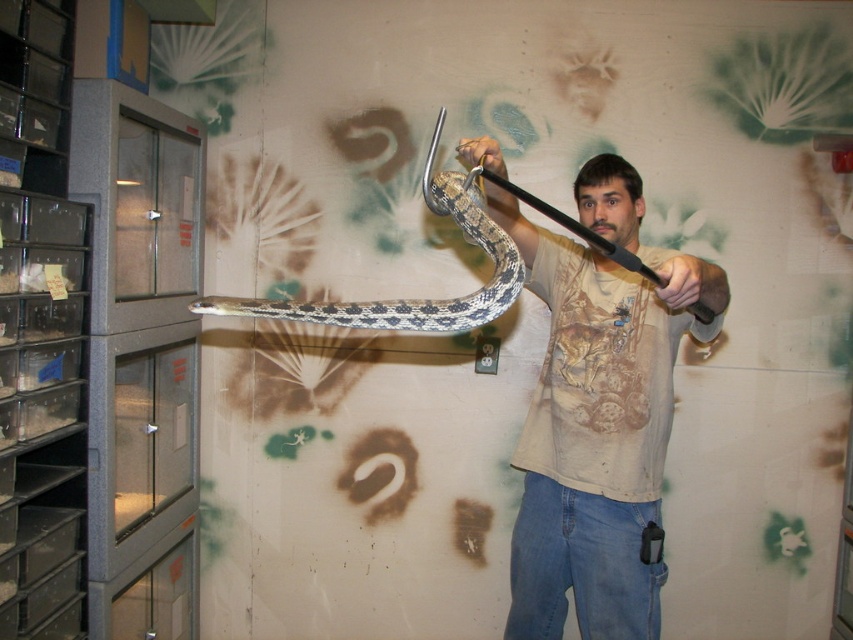
Who is lower down, light brown cotton t-shirt at center or patterned scales snake at center?

light brown cotton t-shirt at center is below.

Is light brown cotton t-shirt at center taller than patterned scales snake at center?

Correct, light brown cotton t-shirt at center is much taller as patterned scales snake at center.

This screenshot has height=640, width=853. I want to click on light brown cotton t-shirt at center, so click(599, 416).

Does light brown cotton t-shirt at center come in front of matte black snake at upper center?

Yes, it is.

Who is more forward, (585, 532) or (485, 193)?

Positioned in front is point (485, 193).

The height and width of the screenshot is (640, 853). What do you see at coordinates (599, 416) in the screenshot?
I see `light brown cotton t-shirt at center` at bounding box center [599, 416].

Find the location of `light brown cotton t-shirt at center`. light brown cotton t-shirt at center is located at coordinates [x=599, y=416].

Is patterned scales snake at center to the left of matte black snake at upper center from the viewer's perspective?

Correct, you'll find patterned scales snake at center to the left of matte black snake at upper center.

This screenshot has height=640, width=853. What do you see at coordinates (412, 300) in the screenshot? I see `patterned scales snake at center` at bounding box center [412, 300].

Identify the location of patterned scales snake at center. Image resolution: width=853 pixels, height=640 pixels. (412, 300).